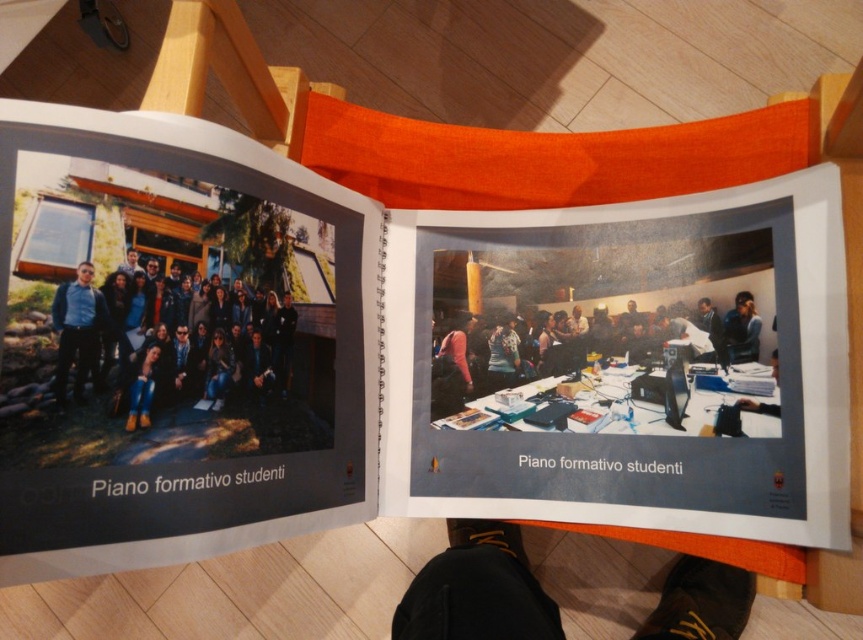
You are a photographer trying to capture a closeup shot of the black leather shoes at lower center and the blue fabric shirt at center in the image. Given that your camera can focus on objects within a 15 inch range, will both items be in focus at the same time?

The black leather shoes at lower center and blue fabric shirt at center are 16.01 inches apart from each other. Since the distance between them exceeds the camera focus range of 15 inches, both items cannot be in focus simultaneously.

You are a photographer who needs to capture a closeup of the blue fabric shirt at center. Since the black leather shoes at lower center is blocking the view, can you adjust your position to avoid the shoes?

The black leather shoes at lower center is bigger than the blue fabric shirt at center, so moving your camera position slightly upwards or to the side might allow you to frame the blue fabric shirt at center while avoiding the larger shoes.

You are looking at the open book on the wooden chair with an orange cushion. The book contains a photo of a group of people. Where in the photo is the dark blue jeans at center located?

The dark blue jeans at center is located at the 2D coordinates point of (x=130, y=344) in the photo.